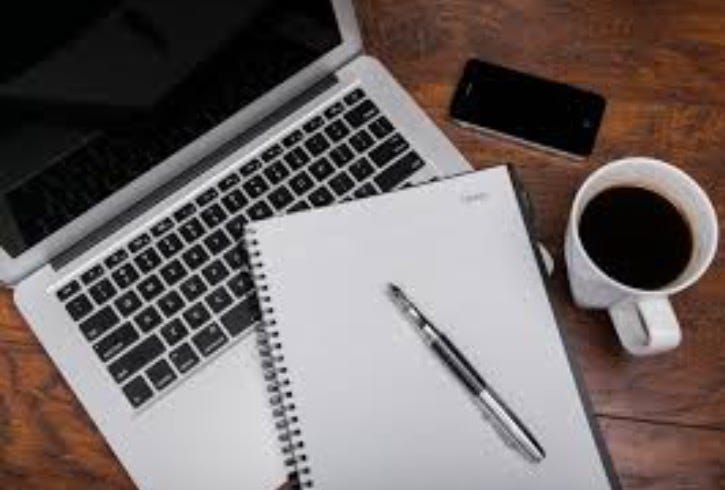
This screenshot has height=490, width=725. I want to click on items touching tabletop, so click(526, 114), click(439, 152), click(579, 452), click(589, 289).